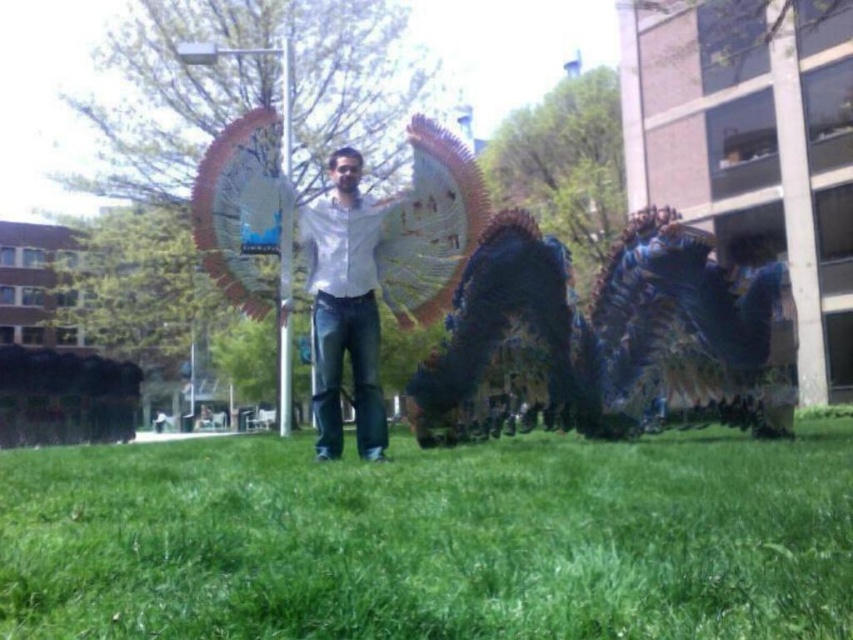
Does white matte shirt at center appear over metallic pole at center?

Yes.

What do you see at coordinates (345, 308) in the screenshot?
I see `white matte shirt at center` at bounding box center [345, 308].

Find the location of a particular element. The width and height of the screenshot is (853, 640). white matte shirt at center is located at coordinates (345, 308).

Which is more to the left, green grass at lower center or metallic pole at center?

metallic pole at center is more to the left.

Is green grass at lower center smaller than metallic pole at center?

No, green grass at lower center is not smaller than metallic pole at center.

Who is more distant from viewer, (x=541, y=467) or (x=283, y=248)?

Point (x=283, y=248)

Image resolution: width=853 pixels, height=640 pixels. I want to click on green grass at lower center, so click(432, 538).

Who is shorter, green grass at lower center or white matte shirt at center?

green grass at lower center

Is point (30, 472) behind point (320, 220)?

No, it is in front of (320, 220).

The width and height of the screenshot is (853, 640). In order to click on green grass at lower center in this screenshot , I will do `click(432, 538)`.